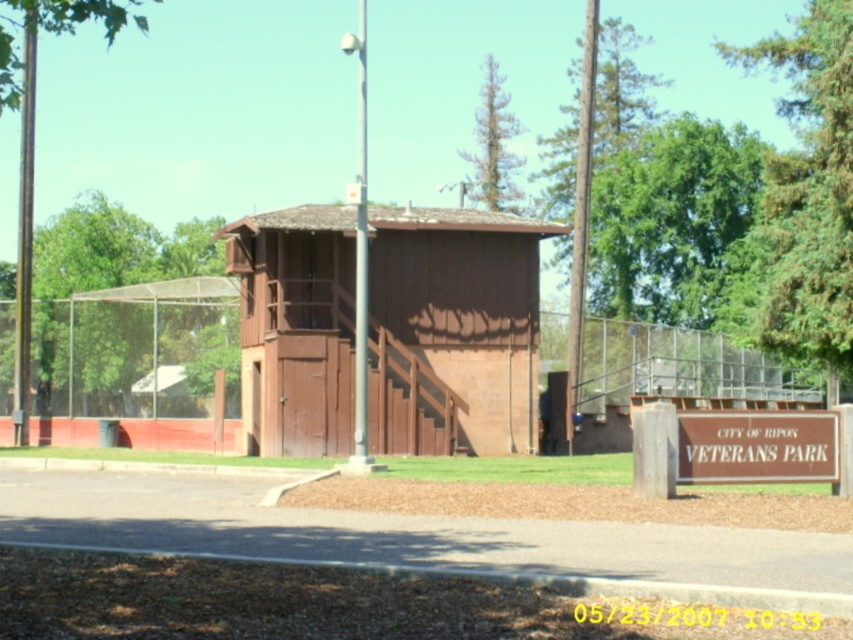
You are a visitor at the park and want to take a photo of the brown wooden fence at center and the brown wooden sign at lower right. Since you have a camera with a fixed focal length, you need to know which object is larger to frame your shot properly. Which one is bigger?

The brown wooden fence at center is bigger than the brown wooden sign at lower right, so you should frame your shot to accommodate the larger size of the brown wooden fence at center.

You are standing at the entrance of the building in the image. There is a point marked at coordinates (x=679, y=365). What does this point indicate?

The point indicates the location of the brown wooden fence at center.

You are standing at the entrance of the building and want to know where the brown wooden fence at center is located in relation to you. Can you determine its position based on the coordinates provided?

The brown wooden fence at center is located at coordinates point (679, 365), which places it to the right and slightly below your current position at the entrance.